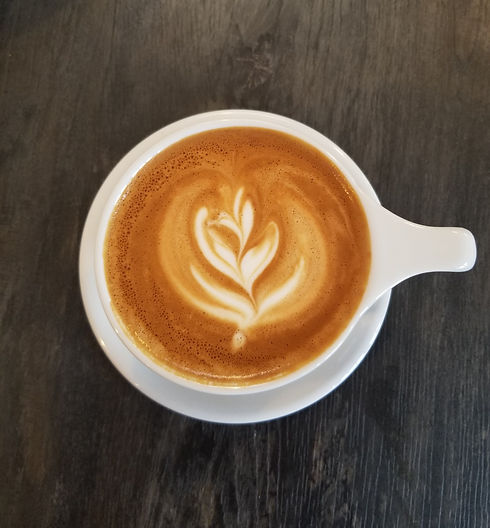
Locate an element on the screen. The height and width of the screenshot is (528, 490). coffee cup is located at coordinates (350, 318).